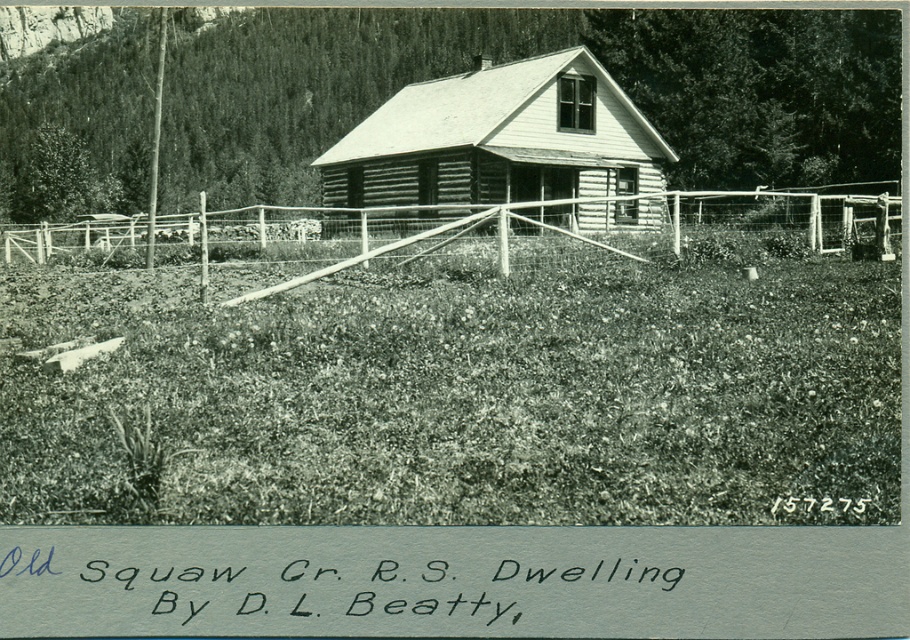
You are standing in front of the wooden cabin at center and want to walk towards the wooden fence at center. Which direction should you move relative to the cabin?

Result: The wooden fence at center is below the wooden cabin at center, so you should move downward towards the wooden fence at center.